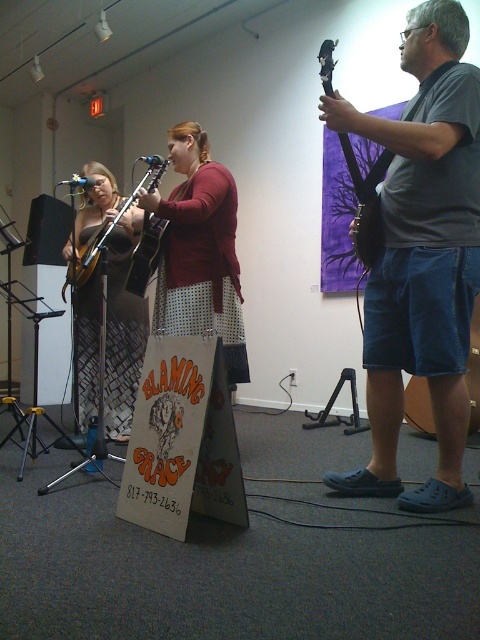
Question: Does brushed metal banjo at left appear on the right side of matte black guitar at lower right?

Choices:
 (A) yes
 (B) no

Answer: (B)

Question: From the image, what is the correct spatial relationship of gray cotton t-shirt at center in relation to glossy black guitar at upper center?

Choices:
 (A) below
 (B) above

Answer: (A)

Question: Which point is farther from the camera taking this photo?

Choices:
 (A) (84, 352)
 (B) (325, 113)
 (C) (88, 256)
 (D) (376, 173)

Answer: (A)

Question: Which of the following is the farthest from the observer?

Choices:
 (A) gray cotton t-shirt at center
 (B) glossy black guitar at upper center
 (C) matte brown acoustic guitar at left

Answer: (C)

Question: Estimate the real-world distances between objects in this image. Which object is closer to the gray cotton t-shirt at center?

Choices:
 (A) matte brown acoustic guitar at left
 (B) matte black guitar at lower right

Answer: (B)

Question: Is matte black guitar at lower right below matte brown acoustic guitar at left?

Choices:
 (A) yes
 (B) no

Answer: (A)